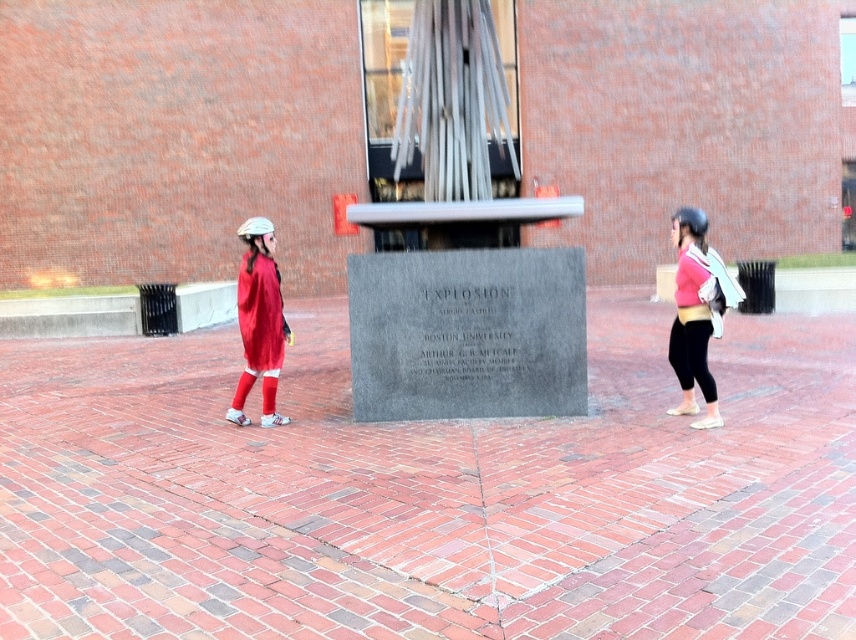
Question: Is matte red sweater at left positioned at the back of pink fabric backpack at right?

Choices:
 (A) no
 (B) yes

Answer: (B)

Question: Which point appears farthest from the camera in this image?

Choices:
 (A) (688, 241)
 (B) (269, 227)

Answer: (B)

Question: Among these points, which one is farthest from the camera?

Choices:
 (A) (247, 266)
 (B) (704, 316)

Answer: (A)

Question: Does matte red sweater at left appear on the right side of pink fabric backpack at right?

Choices:
 (A) yes
 (B) no

Answer: (B)

Question: Is matte red sweater at left above pink fabric backpack at right?

Choices:
 (A) yes
 (B) no

Answer: (B)